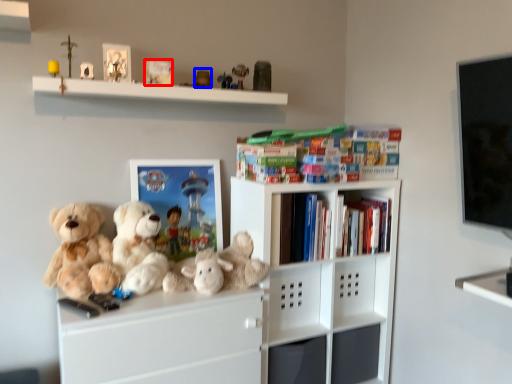
Question: Among these objects, which one is nearest to the camera, book (highlighted by a red box) or toy (highlighted by a blue box)?

Choices:
 (A) book
 (B) toy

Answer: (A)